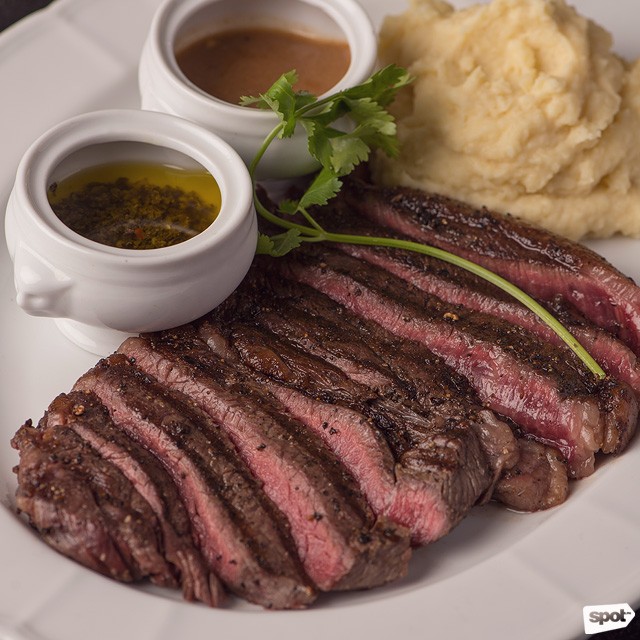
I want to click on cups, so click(224, 256), click(227, 121).